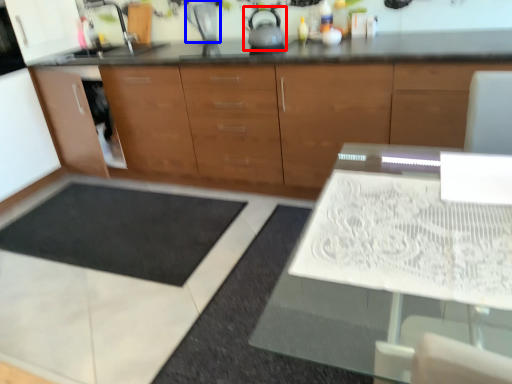
Question: Which of the following is the closest to the observer, tea pot (highlighted by a red box) or appliance (highlighted by a blue box)?

Choices:
 (A) tea pot
 (B) appliance

Answer: (A)